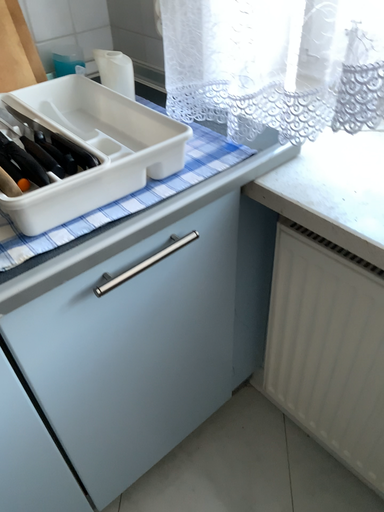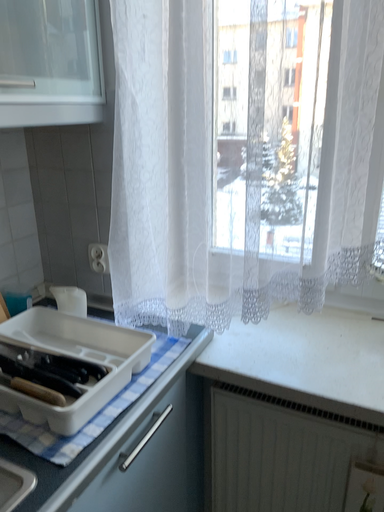
Question: Which way did the camera rotate in the video?

Choices:
 (A) rotated right
 (B) rotated left

Answer: (A)